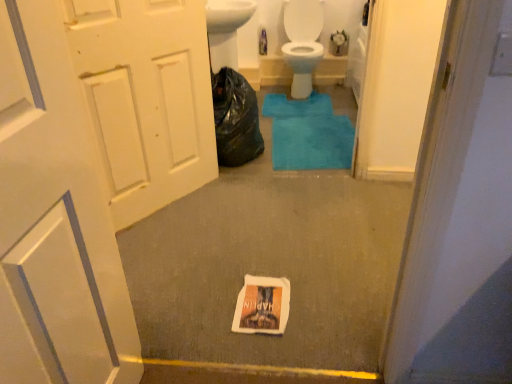
Where is `free space above white paper flyer at center (from a real-world perspective)`? The image size is (512, 384). free space above white paper flyer at center (from a real-world perspective) is located at coordinates (262, 297).